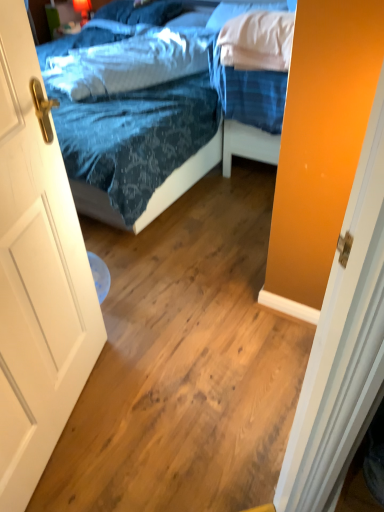
I want to click on unoccupied region to the right of white wooden door at left, so click(x=159, y=419).